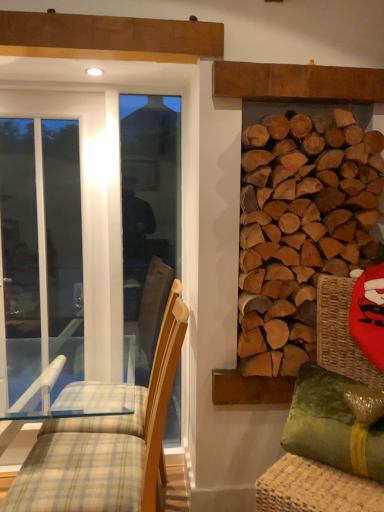
Question: From the image's perspective, is white glass screen door at left positioned above or below green fabric swivel chair at right?

Choices:
 (A) below
 (B) above

Answer: (B)

Question: In terms of size, does white glass screen door at left appear bigger or smaller than green fabric swivel chair at right?

Choices:
 (A) small
 (B) big

Answer: (A)

Question: Which object is the farthest from the green velvet pillow at lower right?

Choices:
 (A) green fabric swivel chair at right
 (B) natural wood logs at right
 (C) light brown wood chair at left
 (D) white glass screen door at left

Answer: (D)

Question: Which object is positioned farthest from the green velvet pillow at lower right?

Choices:
 (A) white glass screen door at left
 (B) natural wood logs at right
 (C) green fabric swivel chair at right
 (D) light brown wood chair at left

Answer: (A)